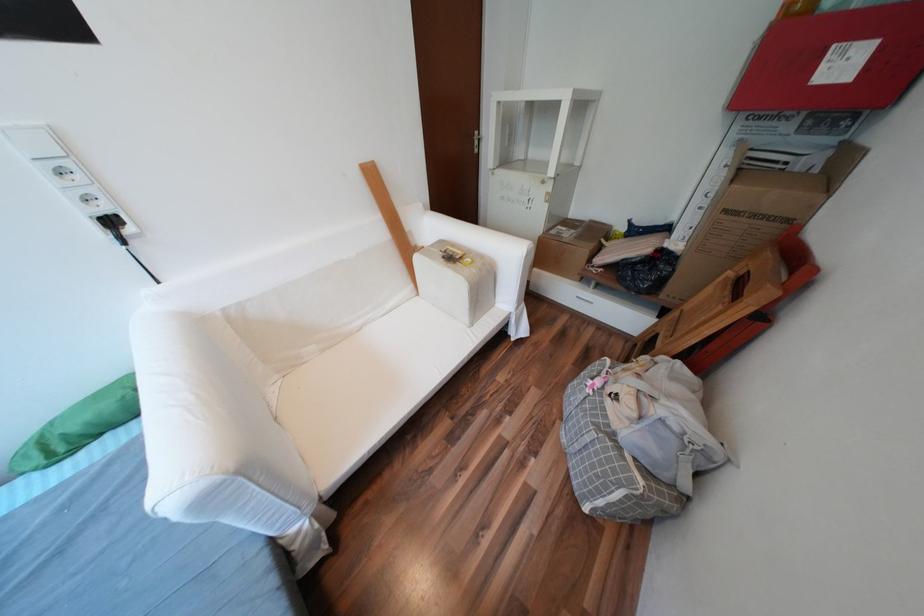
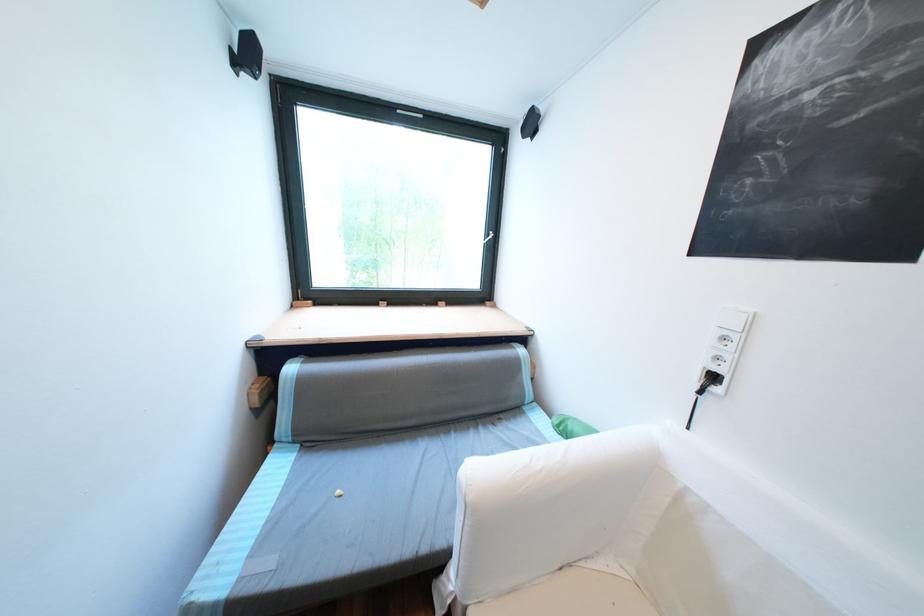
Find the pixel in the second image that matches the point at 138,231 in the first image.

(725, 390)